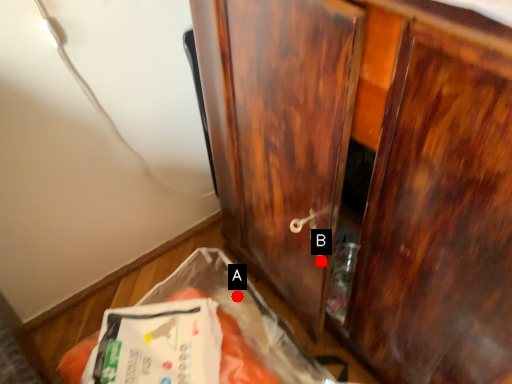
Question: Two points are circled on the image, labeled by A and B beside each circle. Which point is closer to the camera?

Choices:
 (A) A is closer
 (B) B is closer

Answer: (B)